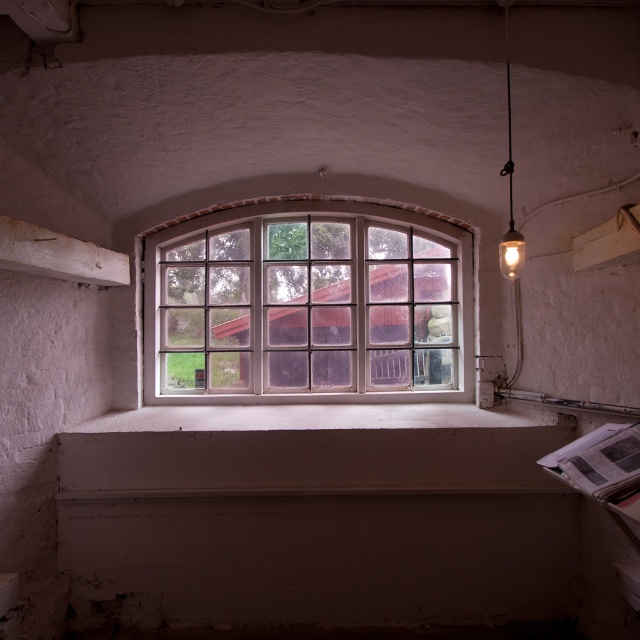
You are standing in the room and want to hang a small picture exactly between the white wooden window frame at center and the matte glass bulb at upper right. Which object should you place the picture closer to in order to center it properly?

The picture should be placed closer to the white wooden window frame at center because it is positioned to the left of the matte glass bulb at upper right, so the midpoint between them would be closer to the window frame.

You are an interior designer planning to place a small potted plant on the window sill. Based on the scene, can you confirm if the white concrete window sill at center is below the white wooden window frame at center?

Yes, the white wooden window frame at center is positioned over the white concrete window sill at center, meaning the window sill is indeed located below the frame and suitable for placing the potted plant.

From the picture: You are standing in the room and want to locate the white wooden window frame at center. Based on the coordinates provided, where should you look?

The white wooden window frame at center is located at coordinates point (307, 305).